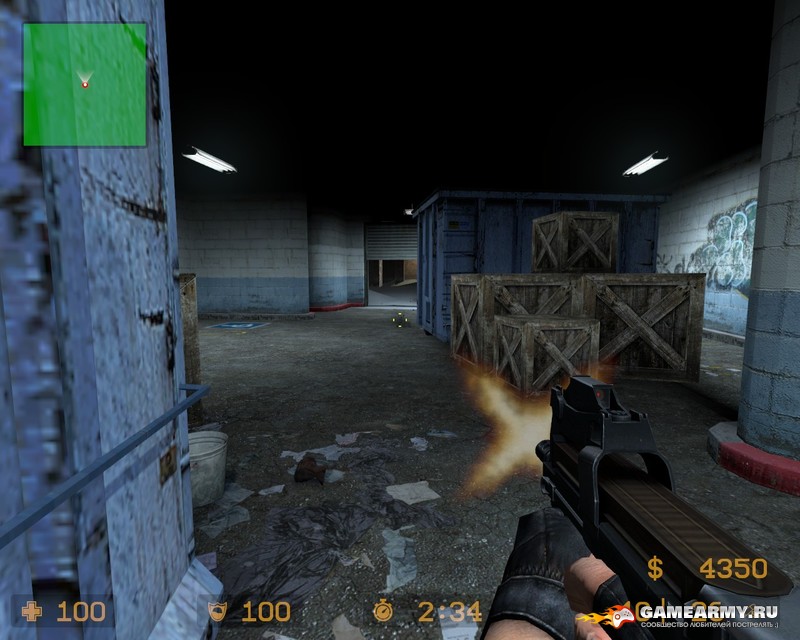
Where is `wooden boxes`? wooden boxes is located at coordinates 542,338, 498,296, 614,316, 578,234, 186,314.